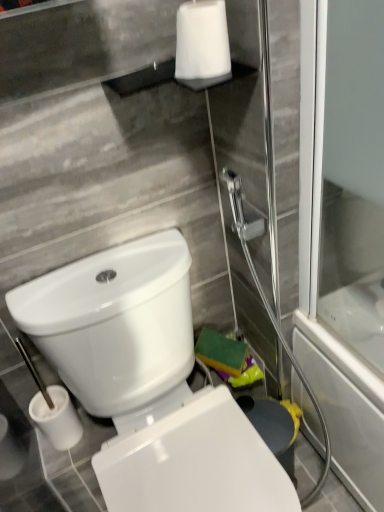
What do you see at coordinates (202, 40) in the screenshot? I see `white matte toilet paper at upper center` at bounding box center [202, 40].

Find the location of a particular element. This screenshot has width=384, height=512. white matte toilet paper at upper center is located at coordinates (202, 40).

Image resolution: width=384 pixels, height=512 pixels. Find the location of `white glossy toilet at lower left`. white glossy toilet at lower left is located at coordinates (148, 382).

This screenshot has width=384, height=512. What do you see at coordinates (148, 382) in the screenshot? I see `white glossy toilet at lower left` at bounding box center [148, 382].

I want to click on white matte toilet paper at upper center, so tap(202, 40).

Does white matte toilet paper at upper center appear on the left side of white glossy toilet at lower left?

Incorrect, white matte toilet paper at upper center is not on the left side of white glossy toilet at lower left.

In the scene shown: Which object is further away from the camera, white matte toilet paper at upper center or white glossy toilet at lower left?

white matte toilet paper at upper center is further away from the camera.

Is point (227, 35) in front of point (82, 402)?

Yes, point (227, 35) is in front of point (82, 402).

From the image's perspective, is white matte toilet paper at upper center above white glossy toilet at lower left?

Yes.

From a real-world perspective, is white matte toilet paper at upper center located beneath white glossy toilet at lower left?

No, from a real-world perspective, white matte toilet paper at upper center is not below white glossy toilet at lower left.

Which of these two, white matte toilet paper at upper center or white glossy toilet at lower left, is wider?

With larger width is white glossy toilet at lower left.

Considering the relative sizes of white matte toilet paper at upper center and white glossy toilet at lower left in the image provided, is white matte toilet paper at upper center shorter than white glossy toilet at lower left?

Indeed, white matte toilet paper at upper center has a lesser height compared to white glossy toilet at lower left.

Considering the sizes of objects white matte toilet paper at upper center and white glossy toilet at lower left in the image provided, who is smaller, white matte toilet paper at upper center or white glossy toilet at lower left?

Smaller between the two is white matte toilet paper at upper center.

Based on the photo, is white glossy toilet at lower left completely or partially inside white matte toilet paper at upper center?

Actually, white glossy toilet at lower left is outside white matte toilet paper at upper center.

Is there a large distance between white matte toilet paper at upper center and white glossy toilet at lower left?

white matte toilet paper at upper center is near white glossy toilet at lower left, not far away.

Is white glossy toilet at lower left at the back of white matte toilet paper at upper center?

white matte toilet paper at upper center is not turned away from white glossy toilet at lower left.

How different are the orientations of white matte toilet paper at upper center and white glossy toilet at lower left in degrees?

The angle between the facing direction of white matte toilet paper at upper center and the facing direction of white glossy toilet at lower left is 0.33 degrees.

How much distance is there between white matte toilet paper at upper center and white glossy toilet at lower left?

A distance of 24.82 inches exists between white matte toilet paper at upper center and white glossy toilet at lower left.

The height and width of the screenshot is (512, 384). Identify the location of toilet paper located above the white glossy toilet at lower left (from the image's perspective). (202, 40).

Visually, is white glossy toilet at lower left positioned to the left or to the right of white matte toilet paper at upper center?

From the image, it's evident that white glossy toilet at lower left is to the left of white matte toilet paper at upper center.

Who is more distant, white glossy toilet at lower left or white matte toilet paper at upper center?

white matte toilet paper at upper center is further from the camera.

Between point (91, 345) and point (182, 78), which one is positioned in front?

The point (182, 78) is in front.

From the image's perspective, is white glossy toilet at lower left positioned above or below white matte toilet paper at upper center?

From the image's perspective, white glossy toilet at lower left appears below white matte toilet paper at upper center.

From a real-world perspective, does white glossy toilet at lower left sit lower than white matte toilet paper at upper center?

A: Indeed, from a real-world perspective, white glossy toilet at lower left is positioned beneath white matte toilet paper at upper center.

Between white glossy toilet at lower left and white matte toilet paper at upper center, which one has smaller width?

With smaller width is white matte toilet paper at upper center.

In terms of height, does white glossy toilet at lower left look taller or shorter compared to white matte toilet paper at upper center?

Considering their sizes, white glossy toilet at lower left has more height than white matte toilet paper at upper center.

Between white glossy toilet at lower left and white matte toilet paper at upper center, which one has smaller size?

white matte toilet paper at upper center.

Can we say white glossy toilet at lower left lies outside white matte toilet paper at upper center?

Yes, white glossy toilet at lower left is outside of white matte toilet paper at upper center.

In the scene shown: Are white glossy toilet at lower left and white matte toilet paper at upper center located far from each other?

white glossy toilet at lower left is near white matte toilet paper at upper center, not far away.

Is white glossy toilet at lower left aimed at white matte toilet paper at upper center?

No, white glossy toilet at lower left is not turned towards white matte toilet paper at upper center.

How different are the orientations of white glossy toilet at lower left and white matte toilet paper at upper center in degrees?

white glossy toilet at lower left and white matte toilet paper at upper center are facing 0.33 degrees away from each other.

This screenshot has width=384, height=512. I want to click on toilet on the left of white matte toilet paper at upper center, so click(148, 382).

I want to click on toilet in front of the white matte toilet paper at upper center, so click(x=148, y=382).

At what (x,y) coordinates should I click in order to perform the action: click on toilet below the white matte toilet paper at upper center (from the image's perspective). Please return your answer as a coordinate pair (x, y). This screenshot has width=384, height=512. Looking at the image, I should click on (148, 382).